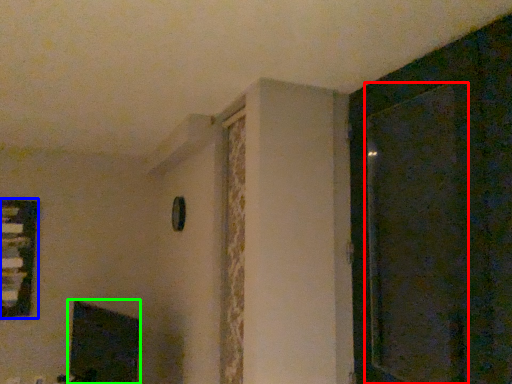
Question: Which object is the closest to the screen door (highlighted by a red box)? Choose among these: window (highlighted by a blue box) or fireplace (highlighted by a green box).

Choices:
 (A) window
 (B) fireplace

Answer: (B)